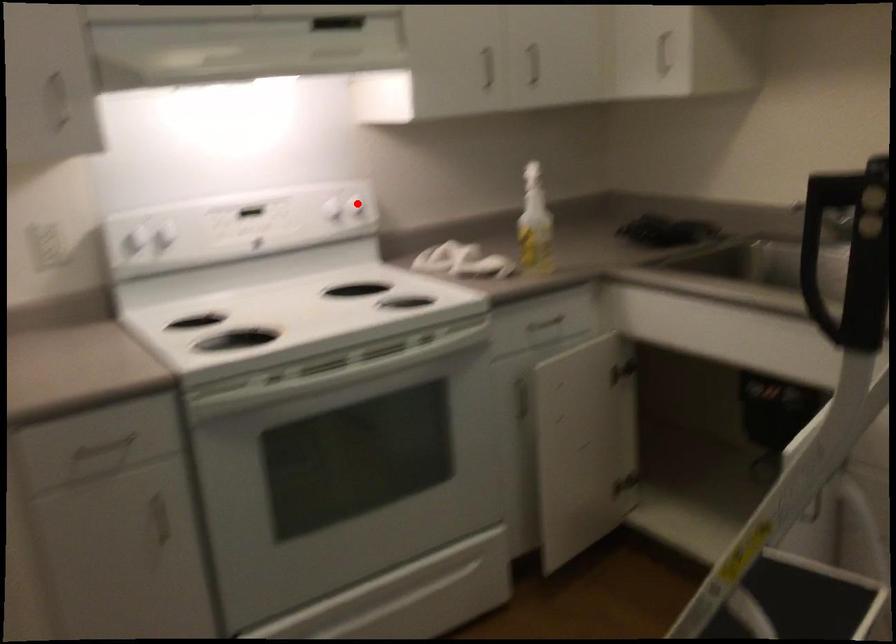
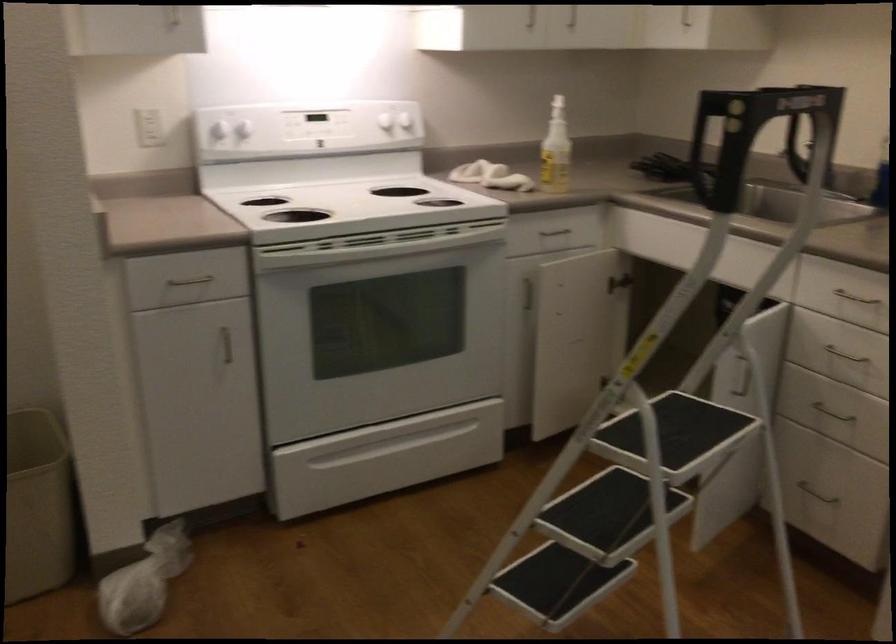
Where in the second image is the point corresponding to the highlighted location from the first image?

(403, 116)